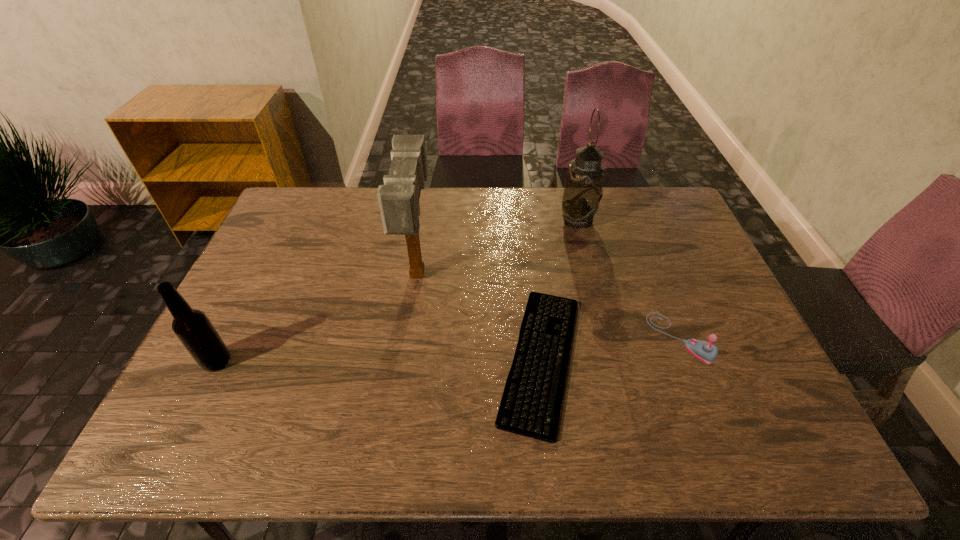
Where is `the farthest object`? the farthest object is located at coordinates (583, 191).

Where is `the fourth object from right to left`? the fourth object from right to left is located at coordinates pyautogui.click(x=398, y=198).

This screenshot has height=540, width=960. What are the coordinates of `the leftmost object` in the screenshot? It's located at (195, 331).

Locate an element on the screen. The image size is (960, 540). the third tallest object is located at coordinates (195, 331).

The width and height of the screenshot is (960, 540). Identify the location of joystick. (705, 351).

This screenshot has height=540, width=960. In order to click on the fourth tallest object in this screenshot , I will do `click(705, 351)`.

The height and width of the screenshot is (540, 960). In order to click on the shortest object in this screenshot , I will do `click(530, 406)`.

Find the location of a particular element. The width and height of the screenshot is (960, 540). free region located on the back of the oil lamp is located at coordinates (572, 198).

I want to click on free region located 0.250m on the back of the mallet, so click(x=429, y=197).

Locate an element on the screen. The width and height of the screenshot is (960, 540). vacant space located 0.070m on the front of the leftmost object is located at coordinates (197, 400).